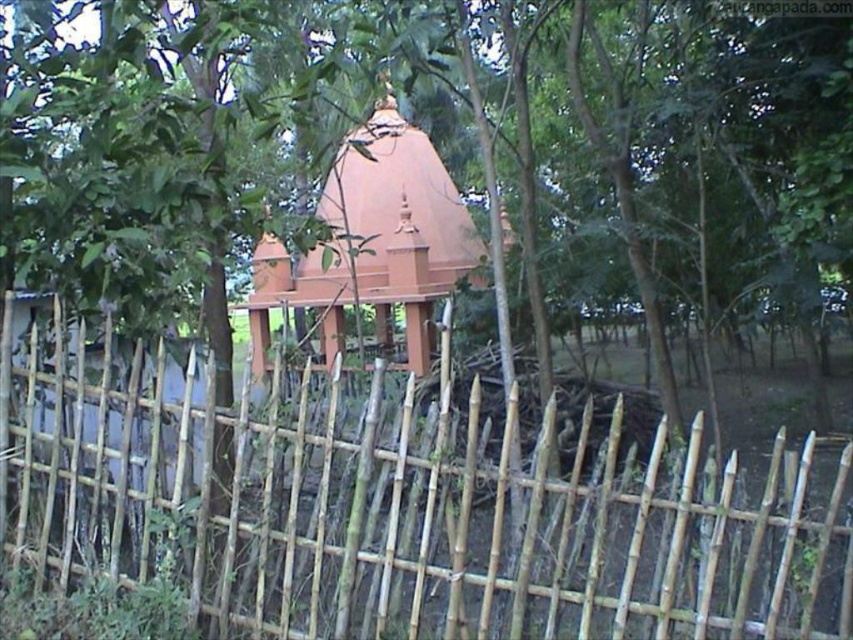
Is point (51, 449) more distant than point (399, 122)?

No, (51, 449) is closer to viewer.

Is point (495, 593) in front of point (381, 193)?

Yes, it is in front of point (381, 193).

The height and width of the screenshot is (640, 853). Find the location of `bamboo fence at center`. bamboo fence at center is located at coordinates (401, 506).